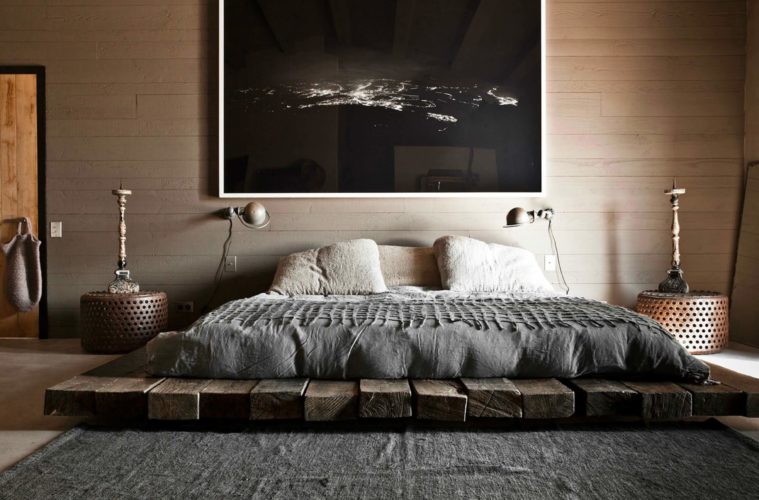
Find the location of `artwork`. artwork is located at coordinates (518, 156).